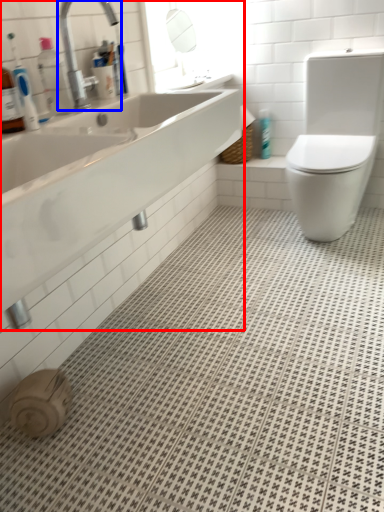
Question: Among these objects, which one is farthest to the camera, sink (highlighted by a red box) or tap (highlighted by a blue box)?

Choices:
 (A) sink
 (B) tap

Answer: (B)